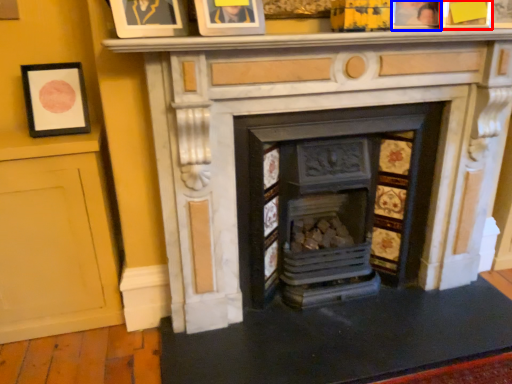
Question: Which object is closer to the camera taking this photo, picture frame (highlighted by a red box) or picture frame (highlighted by a blue box)?

Choices:
 (A) picture frame
 (B) picture frame

Answer: (A)